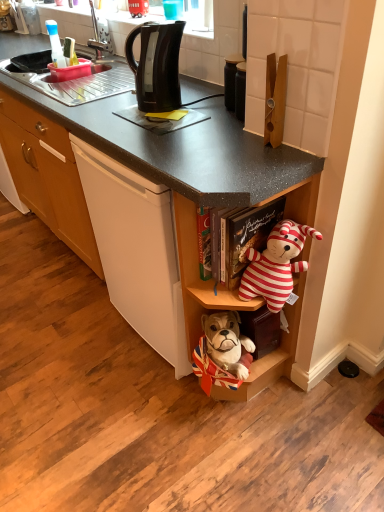
Find the location of `blank space to the left of black plastic kettle at upper center`. blank space to the left of black plastic kettle at upper center is located at coordinates (112, 110).